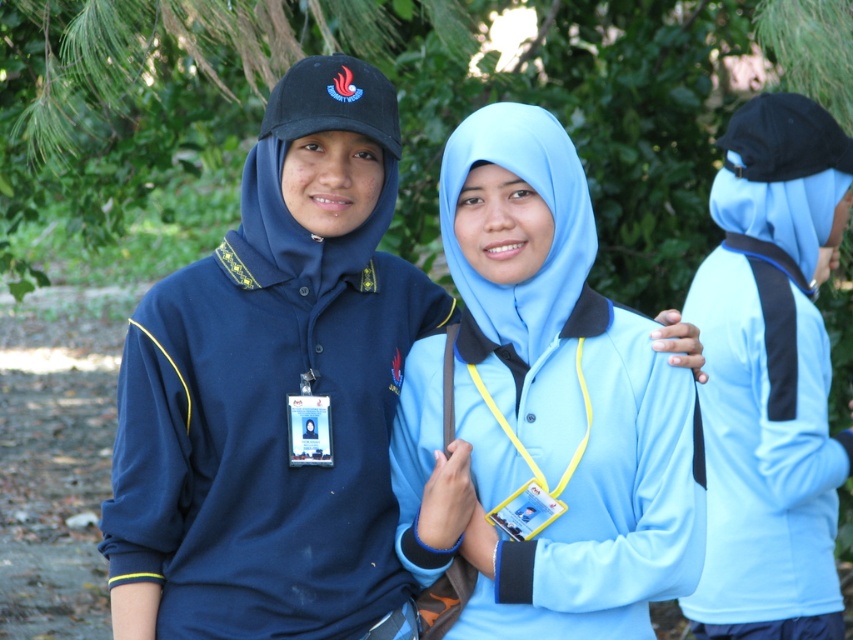
You are standing in the park and see a point marked at coordinates (x=276, y=392). Which object is this point located on?

The point marked at coordinates (x=276, y=392) is located on the matte blue hoodie at center.

You are a photographer trying to capture a clear shot of both the light blue fabric hijab at center and the light blue fabric at right. Based on their positions, which one should you focus on first to ensure both are in focus?

You should focus on the light blue fabric hijab at center first because it is closer to the viewer than the light blue fabric at right. By focusing on the closer object, the farther one will also be in focus due to the depth of field.

You are a photographer trying to capture both the matte blue hoodie at center and the light blue fabric hijab at center in the same frame. Based on their positions, which one should you focus on first to ensure both are in focus?

The matte blue hoodie at center is further to the viewer than the light blue fabric hijab at center, so you should focus on the matte blue hoodie at center first to ensure both are in focus.